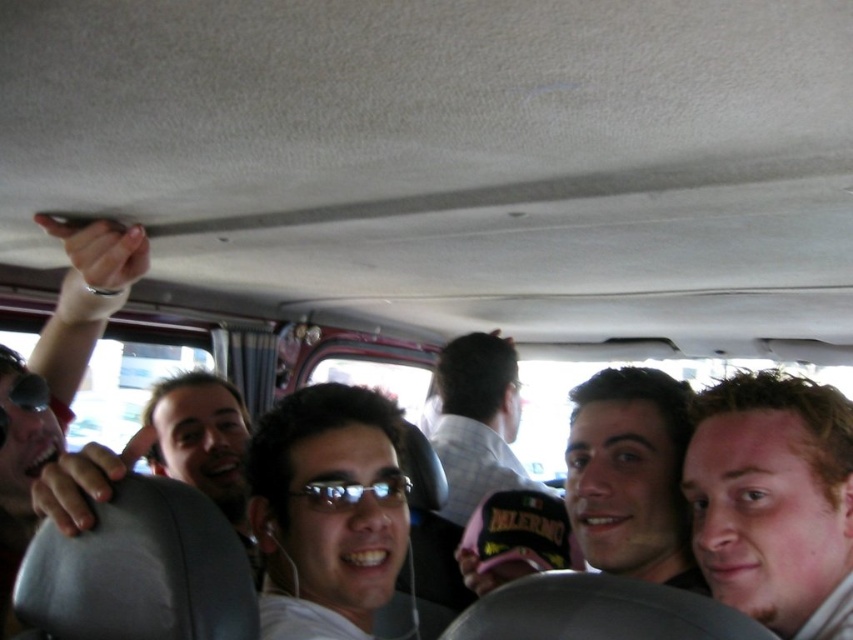
Does pink fabric cap at center have a lesser width compared to clear plastic glasses at center?

In fact, pink fabric cap at center might be wider than clear plastic glasses at center.

Can you confirm if pink fabric cap at center is taller than clear plastic glasses at center?

Correct, pink fabric cap at center is much taller as clear plastic glasses at center.

Is point (575, 397) behind point (305, 497)?

Yes, it is behind point (305, 497).

Where is `pink fabric cap at center`? pink fabric cap at center is located at coordinates (631, 476).

Does point (656, 520) come closer to viewer compared to point (10, 628)?

Yes, it is in front of point (10, 628).

Between pink fabric cap at center and matte black sunglasses at upper left, which one has more height?

matte black sunglasses at upper left is taller.

What do you see at coordinates (631, 476) in the screenshot?
I see `pink fabric cap at center` at bounding box center [631, 476].

You are a GUI agent. You are given a task and a screenshot of the screen. Output one action in this format:
    pyautogui.click(x=<x>, y=<y>)
    Task: Click on the pink fabric cap at center
    Image resolution: width=853 pixels, height=640 pixels.
    Given the screenshot: What is the action you would take?
    tap(631, 476)

Between point (746, 413) and point (517, 401), which one is positioned behind?

The point (517, 401) is more distant.

Can you confirm if light brown hair at center is wider than white checkered shirt at center?

Incorrect, light brown hair at center's width does not surpass white checkered shirt at center's.

Is point (750, 401) closer to viewer compared to point (445, 449)?

Yes, point (750, 401) is in front of point (445, 449).

I want to click on light brown hair at center, so click(772, 497).